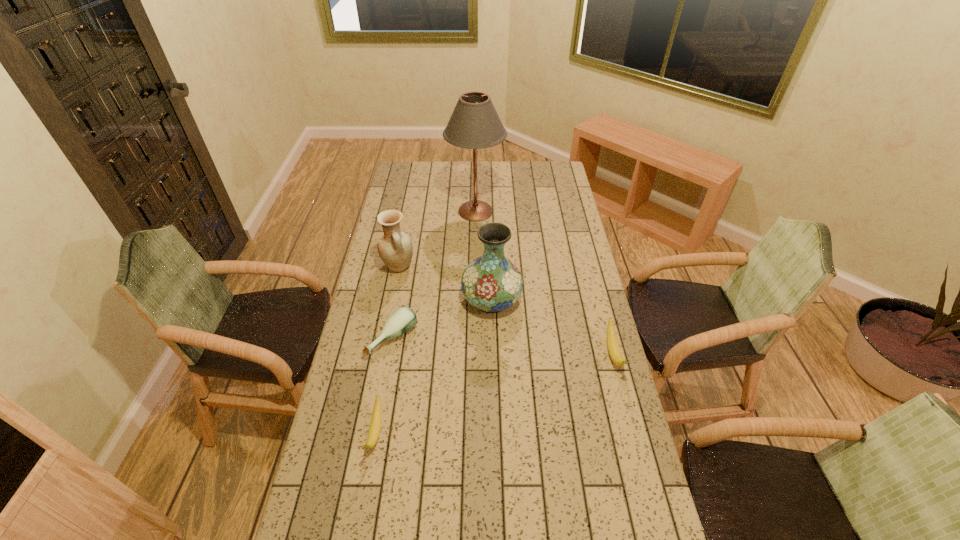
At what (x,y) coordinates should I click in order to perform the action: click on blank space located on the right of the pottery. Please return your answer as a coordinate pair (x, y). The image size is (960, 540). Looking at the image, I should click on (429, 267).

The width and height of the screenshot is (960, 540). In order to click on free spot located 0.060m on the front-facing side of the farthest object in this screenshot , I will do `click(516, 211)`.

At what (x,y) coordinates should I click in order to perform the action: click on vacant region located on the left of the second tallest object. Please return your answer as a coordinate pair (x, y). Looking at the image, I should click on (377, 299).

Locate an element on the screen. free space located 0.170m on the right of the bottle is located at coordinates (465, 339).

Where is `banana situated at the left edge`? This screenshot has height=540, width=960. banana situated at the left edge is located at coordinates (375, 424).

Where is `pottery located in the left edge section of the desktop`? This screenshot has width=960, height=540. pottery located in the left edge section of the desktop is located at coordinates (395, 248).

The height and width of the screenshot is (540, 960). In order to click on bottle present at the left edge in this screenshot , I will do click(403, 319).

Locate an element on the screen. This screenshot has height=540, width=960. object at the right edge is located at coordinates (613, 346).

Locate an element on the screen. The image size is (960, 540). free space at the far edge of the desktop is located at coordinates (463, 178).

Where is `free space at the near edge`? The height and width of the screenshot is (540, 960). free space at the near edge is located at coordinates (385, 532).